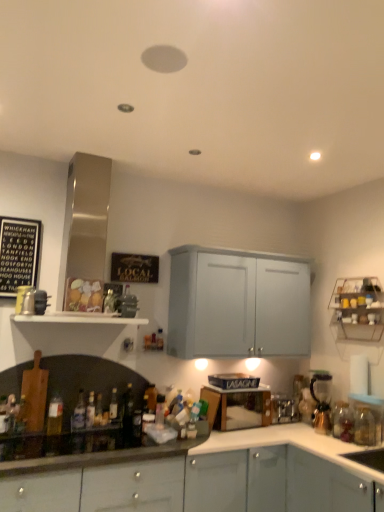
Question: Is translucent glass bottle at lower left, the fourth bottle viewed from the right, further to the viewer compared to white matte shelf at center, the first shelf when ordered from left to right?

Choices:
 (A) no
 (B) yes

Answer: (B)

Question: Is translucent glass bottle at lower left, which is the seventh bottle in left-to-right order, bigger than white matte shelf at center, which is counted as the second shelf, starting from the right?

Choices:
 (A) yes
 (B) no

Answer: (B)

Question: From a real-world perspective, is translucent glass bottle at lower left, which is the seventh bottle in left-to-right order, located beneath white matte shelf at center, which is counted as the second shelf, starting from the right?

Choices:
 (A) yes
 (B) no

Answer: (A)

Question: Is translucent glass bottle at lower left, which is the seventh bottle in left-to-right order, outside white matte shelf at center, the first shelf when ordered from left to right?

Choices:
 (A) yes
 (B) no

Answer: (A)

Question: Can you confirm if translucent glass bottle at lower left, the fourth bottle viewed from the right, is thinner than white matte shelf at center, which is counted as the second shelf, starting from the right?

Choices:
 (A) yes
 (B) no

Answer: (A)

Question: Does translucent glass bottle at lower left, the fourth bottle viewed from the right, have a smaller size compared to white matte shelf at center, the first shelf when ordered from left to right?

Choices:
 (A) yes
 (B) no

Answer: (A)

Question: Is metallic wire rack at upper right, arranged as the first shelf when viewed from the right, positioned with its back to translucent glass bottle at lower center, marked as the 3th bottle in a right-to-left arrangement?

Choices:
 (A) yes
 (B) no

Answer: (B)

Question: Does metallic wire rack at upper right, arranged as the first shelf when viewed from the right, have a greater width compared to translucent glass bottle at lower center, arranged as the eighth bottle when viewed from the left?

Choices:
 (A) no
 (B) yes

Answer: (B)

Question: From a real-world perspective, does metallic wire rack at upper right, arranged as the first shelf when viewed from the right, sit lower than translucent glass bottle at lower center, arranged as the eighth bottle when viewed from the left?

Choices:
 (A) no
 (B) yes

Answer: (A)

Question: Is metallic wire rack at upper right, arranged as the first shelf when viewed from the right, closer to the viewer compared to translucent glass bottle at lower center, arranged as the eighth bottle when viewed from the left?

Choices:
 (A) yes
 (B) no

Answer: (B)

Question: From a real-world perspective, is metallic wire rack at upper right, arranged as the first shelf when viewed from the right, physically above translucent glass bottle at lower center, arranged as the eighth bottle when viewed from the left?

Choices:
 (A) yes
 (B) no

Answer: (A)

Question: Is metallic wire rack at upper right, arranged as the first shelf when viewed from the right, at the left side of translucent glass bottle at lower center, marked as the 3th bottle in a right-to-left arrangement?

Choices:
 (A) yes
 (B) no

Answer: (B)

Question: Does translucent glass bottle at lower left, which is the seventh bottle in left-to-right order, lie behind translucent glass bottle at lower center, the second bottle viewed from the right?

Choices:
 (A) no
 (B) yes

Answer: (B)